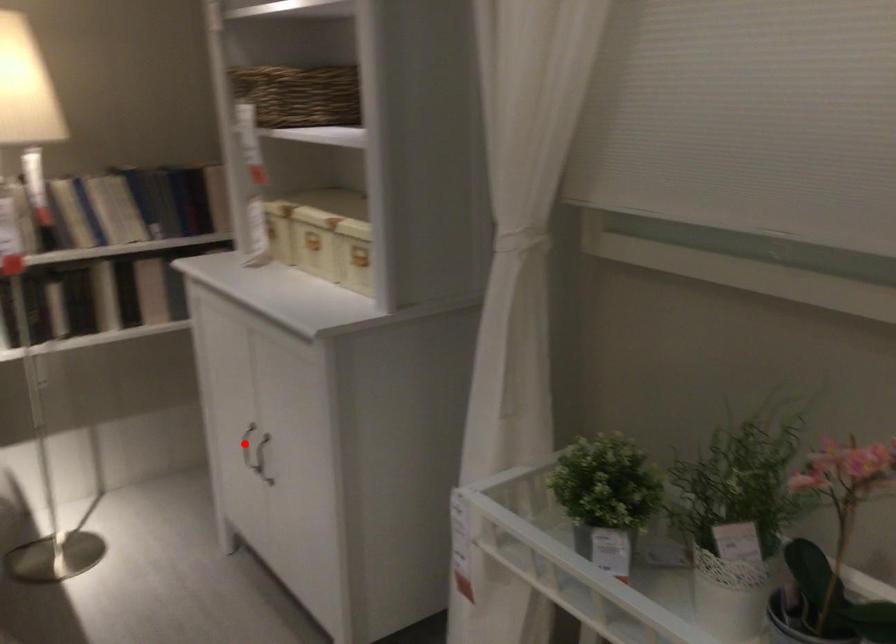
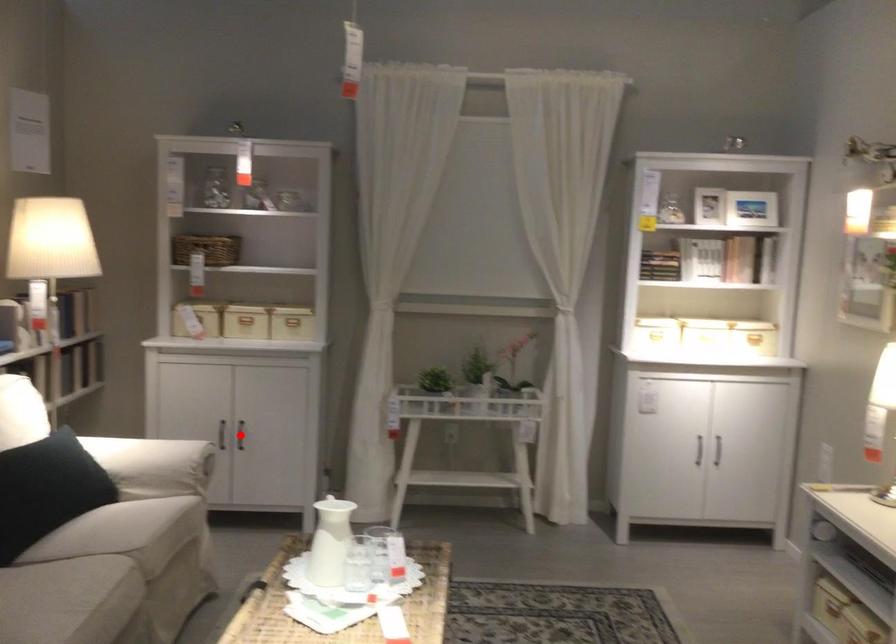
I am providing you with two images of the same scene from different viewpoints. A red point is marked on the first image and another point is marked on the second image. Are the points marked in image1 and image2 representing the same 3D position?

No